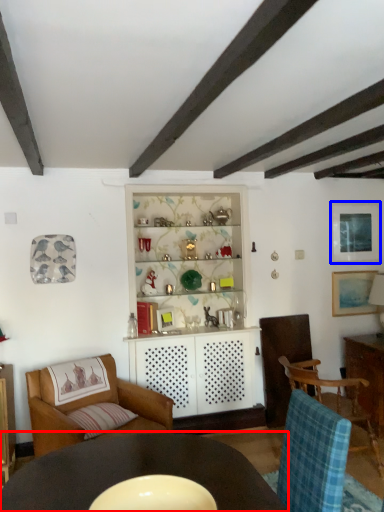
Question: Which object is further to the camera taking this photo, table (highlighted by a red box) or picture frame (highlighted by a blue box)?

Choices:
 (A) table
 (B) picture frame

Answer: (B)